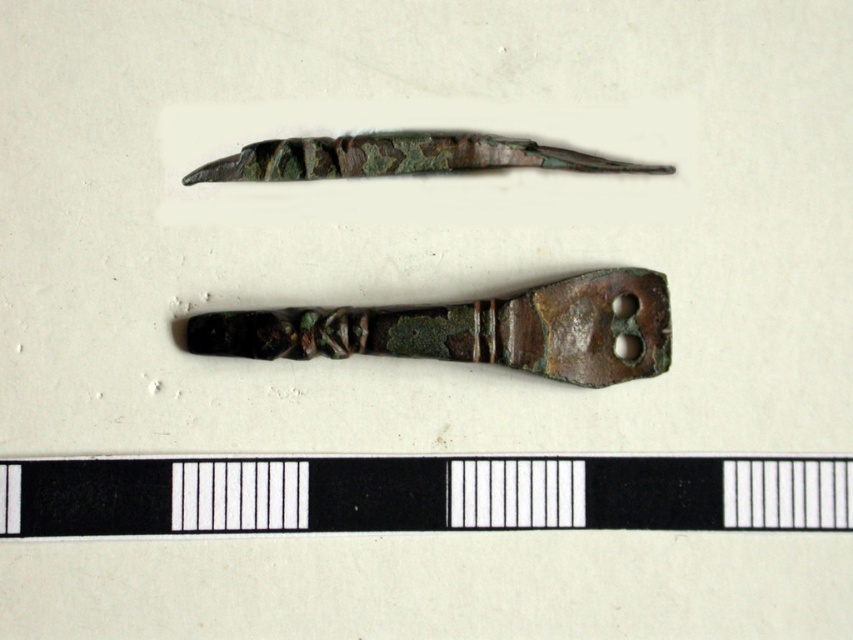
Which is behind, point (654, 369) or point (299, 168)?

The point (654, 369) is more distant.

Can you confirm if rusty bronze handle at center is positioned to the left of green patina metal razor at upper center?

In fact, rusty bronze handle at center is to the right of green patina metal razor at upper center.

Does point (521, 333) lie in front of point (418, 168)?

Yes, point (521, 333) is in front of point (418, 168).

Locate an element on the screen. The image size is (853, 640). rusty bronze handle at center is located at coordinates (474, 330).

Which is behind, point (838, 481) or point (392, 132)?

Point (392, 132)

Between black matte ruler at bottom and green patina metal razor at upper center, which one has less height?

green patina metal razor at upper center is shorter.

Which is behind, point (248, 502) or point (271, 173)?

The point (248, 502) is more distant.

The height and width of the screenshot is (640, 853). I want to click on black matte ruler at bottom, so click(x=419, y=493).

Is black matte ruler at bottom to the right of rusty bronze handle at center from the viewer's perspective?

Incorrect, black matte ruler at bottom is not on the right side of rusty bronze handle at center.

Who is lower down, black matte ruler at bottom or rusty bronze handle at center?

black matte ruler at bottom is below.

The width and height of the screenshot is (853, 640). Describe the element at coordinates (419, 493) in the screenshot. I see `black matte ruler at bottom` at that location.

This screenshot has width=853, height=640. I want to click on black matte ruler at bottom, so click(419, 493).